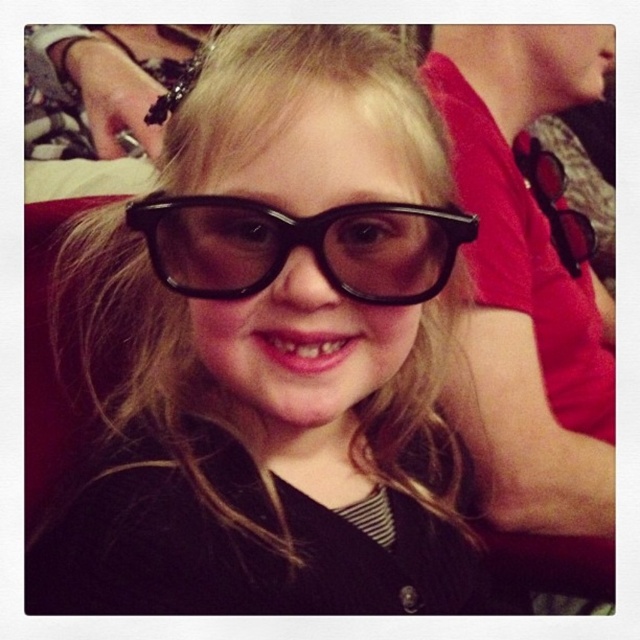
This screenshot has height=640, width=640. Describe the element at coordinates (269, 352) in the screenshot. I see `black plastic glasses at center` at that location.

Does black plastic glasses at center appear on the left side of black glossy glasses at center?

Yes, black plastic glasses at center is to the left of black glossy glasses at center.

This screenshot has width=640, height=640. Find the location of `black plastic glasses at center`. black plastic glasses at center is located at coordinates (269, 352).